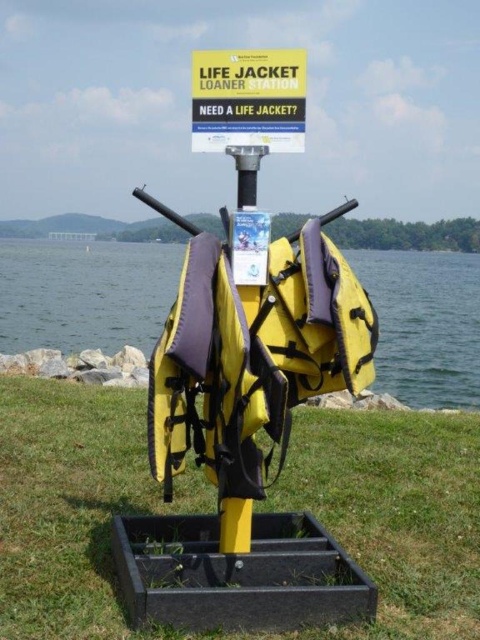
You are standing at the life jacket loaner station and need to place a small potted plant between the green grass at center and the metallic pole at center. Considering their heights, which object should the potted plant be placed closer to?

The green grass at center has a lesser height compared to metallic pole at center. Since the potted plant is small, it should be placed closer to the green grass at center to ensure visibility and stability.

You are at the lake and see the life jacket loaner station with a yellow fabric life jacket at center and yellow fabric life jackets at center. Which one is smaller?

The yellow fabric life jacket at center is smaller than the yellow fabric life jackets at center.

You are standing at the origin point of the coordinate system in the image. The life jacket loaner station is located at the center. Can you determine the exact 2D coordinates of the yellow fabric life jackets at center?

The yellow fabric life jackets at center are located at the 2D coordinates of point (84, 292).